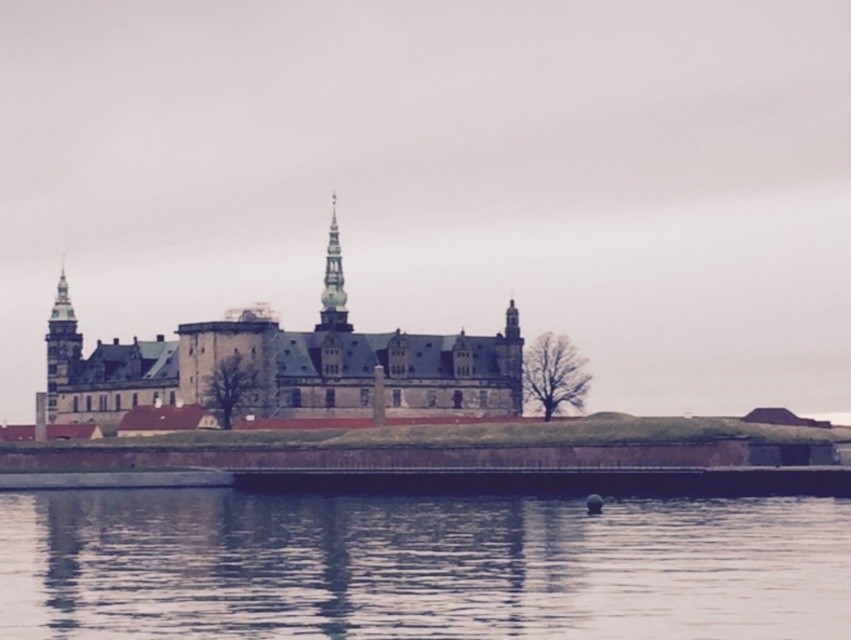
Which is more to the right, smooth water at lower center or smooth gray stone tower at center?

smooth water at lower center is more to the right.

Find the location of a particular element. This screenshot has height=640, width=851. smooth water at lower center is located at coordinates pyautogui.click(x=418, y=566).

Who is taller, brown stone castle at center or smooth gray stone tower at center?

With more height is smooth gray stone tower at center.

Which is below, brown stone castle at center or smooth gray stone tower at center?

Positioned lower is brown stone castle at center.

Is point (269, 381) positioned behind point (334, 326)?

No.

This screenshot has height=640, width=851. I want to click on brown stone castle at center, so click(281, 368).

In the scene shown: Is smooth water at lower center to the left of brown stone castle at center from the viewer's perspective?

In fact, smooth water at lower center is to the right of brown stone castle at center.

The image size is (851, 640). Describe the element at coordinates (418, 566) in the screenshot. I see `smooth water at lower center` at that location.

You are a GUI agent. You are given a task and a screenshot of the screen. Output one action in this format:
    pyautogui.click(x=<x>, y=<y>)
    Task: Click on the smooth water at lower center
    This screenshot has height=640, width=851.
    Given the screenshot: What is the action you would take?
    pyautogui.click(x=418, y=566)